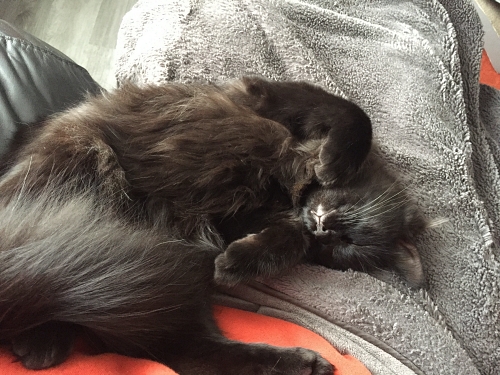
Identify the location of grey blanket. (427, 141).